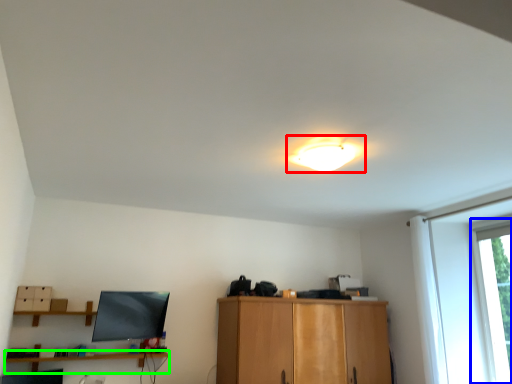
Question: Based on their relative distances, which object is farther from lamp (highlighted by a red box)? Choose from window (highlighted by a blue box) and shelf (highlighted by a green box).

Choices:
 (A) window
 (B) shelf

Answer: (B)